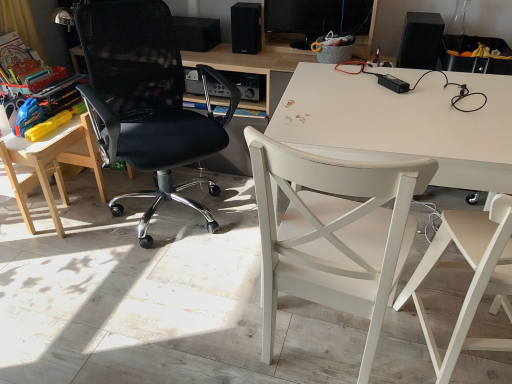
Locate an element on the screen. The image size is (512, 384). free region under black mesh office chair at left, positioned as the 3th chair in right-to-left order (from a real-world perspective) is located at coordinates tap(178, 207).